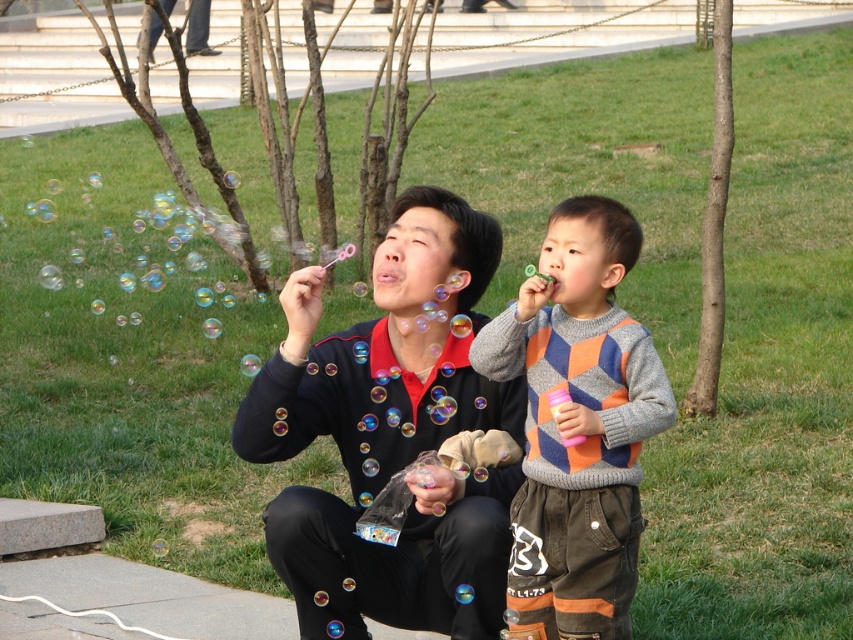
You are a drone operator trying to capture a photo of the matte black sweater at center. The drone is currently at coordinates point A. To ensure the sweater is in the frame, you need to adjust the camera angle. Given that the sweater is at point 0.680, 0.461, is it positioned to the left or right of the center of the image?

The matte black sweater at center is located at point (392, 435), which means it is positioned to the right of the center of the image since the x coordinate is greater than 0.5.

Consider the image. You are a photographer standing at the camera position. You want to capture a closeup shot of the matte black sweater at center. Considering the distance between you and the sweater, what is the minimum focal length lens you need to use if your camera sensor is 36mm wide and you want the sweater to occupy 24mm of the frame?

The minimum focal length lens required is approximately 7.5 meters. However, this calculation assumes ideal conditions and may vary slightly based on exact positioning and sensor specifics.